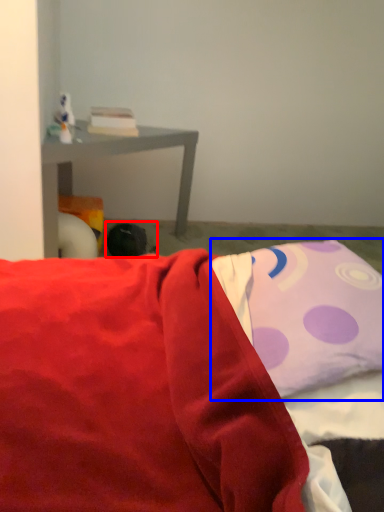
Question: Which object appears closest to the camera in this image, bean bag chair (highlighted by a red box) or pillow (highlighted by a blue box)?

Choices:
 (A) bean bag chair
 (B) pillow

Answer: (B)